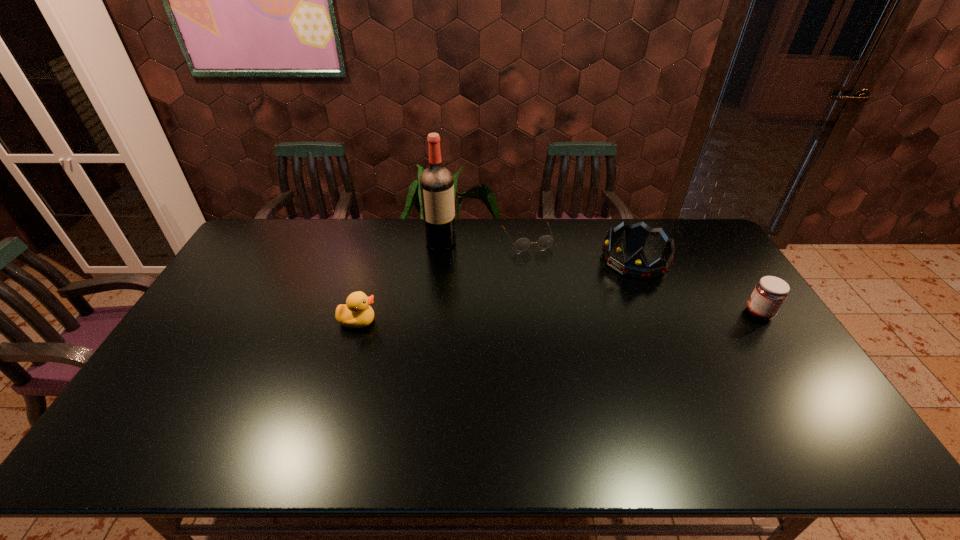
Locate an element on the screen. The width and height of the screenshot is (960, 540). free location located at the front of the tiara with jewels is located at coordinates click(532, 318).

Where is `vacant space located 0.110m at the front of the tiara with jewels`? vacant space located 0.110m at the front of the tiara with jewels is located at coordinates (589, 285).

At what (x,y) coordinates should I click in order to perform the action: click on vacant area situated 0.390m at the front of the tiara with jewels. Please return your answer as a coordinate pair (x, y). The width and height of the screenshot is (960, 540). Looking at the image, I should click on (524, 322).

Locate an element on the screen. The height and width of the screenshot is (540, 960). vacant region located on the temples of the spectacles is located at coordinates (539, 265).

I want to click on vacant space located 0.270m on the temples of the spectacles, so click(x=557, y=305).

You are a GUI agent. You are given a task and a screenshot of the screen. Output one action in this format:
    pyautogui.click(x=<x>, y=<y>)
    Task: Click on the free space located 0.300m on the temples of the spectacles
    The width and height of the screenshot is (960, 540).
    Given the screenshot: What is the action you would take?
    pyautogui.click(x=560, y=312)

Locate an element on the screen. free spot located 0.350m on the front-facing side of the tallest object is located at coordinates (497, 312).

Find the location of a particular element. Image resolution: width=960 pixels, height=540 pixels. vacant space located on the front-facing side of the tallest object is located at coordinates (456, 261).

Where is `vacant space located on the front-facing side of the tallest object`? The width and height of the screenshot is (960, 540). vacant space located on the front-facing side of the tallest object is located at coordinates (478, 289).

Identify the location of tiara that is at the far edge. (637, 266).